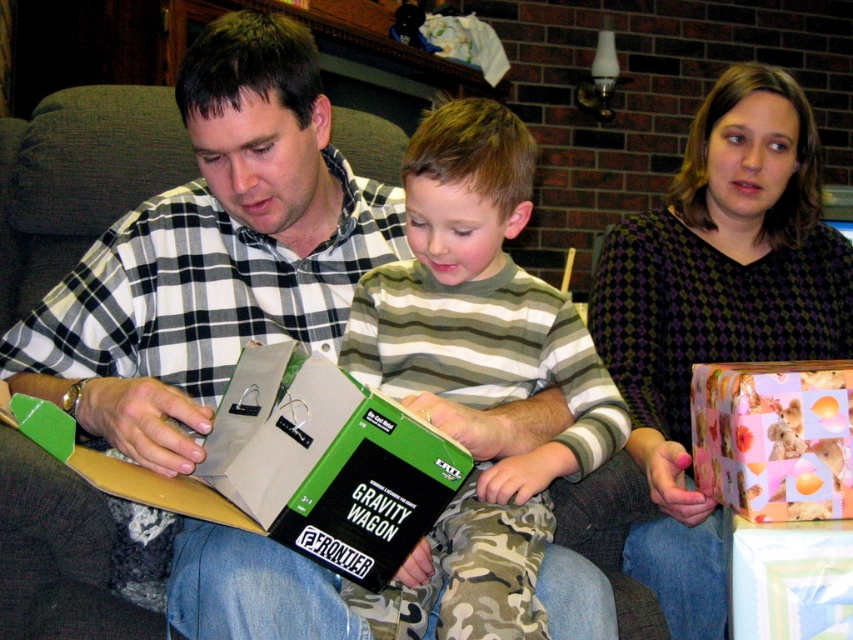
You are standing in the living room and want to reach the point at coordinates point (x=827, y=252). Can you walk straight to it from where you are?

The distance between you and point (x=827, y=252) is 5.15 feet, so yes, you can walk straight to it since there is enough space.

You are a photographer trying to capture a clear photo of the green matte box at center. However, the dark purple checkered sweater at upper right is blocking your view. Can you move the sweater to get a clear shot of the box?

The dark purple checkered sweater at upper right is further to the viewer than the green matte box at center, so moving the sweater would allow a clear view of the box.

You are standing at the origin point in the image. Which of the two points, point (674, 499) or point (350, 525), is closer to you?

Point (350, 525) is closer to you because it is in front of point (674, 499).